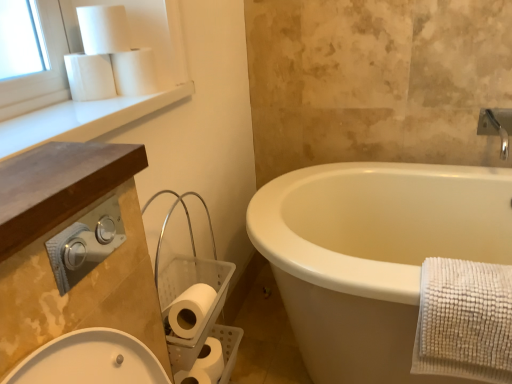
This screenshot has width=512, height=384. In order to click on free spot above white textured bath towel at right (from a real-world perspective) in this screenshot , I will do `click(468, 276)`.